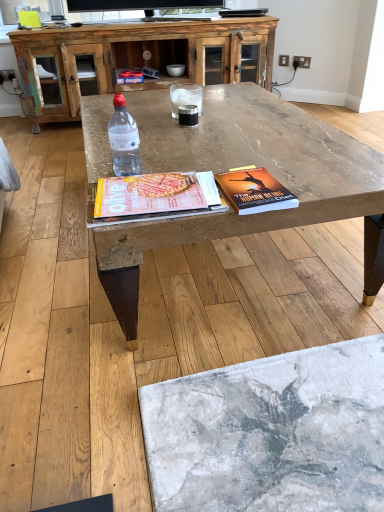
Identify the location of vacant region above hardcover book at center (from a real-world perspective). The width and height of the screenshot is (384, 512). (253, 185).